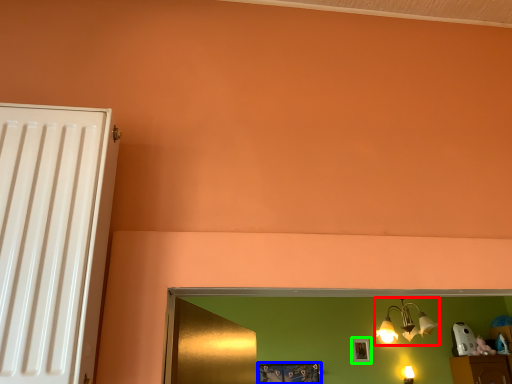
Question: Which object is positioned closest to lamp (highlighted by a red box)? Select from picture frame (highlighted by a blue box) and picture frame (highlighted by a green box).

Choices:
 (A) picture frame
 (B) picture frame

Answer: (B)